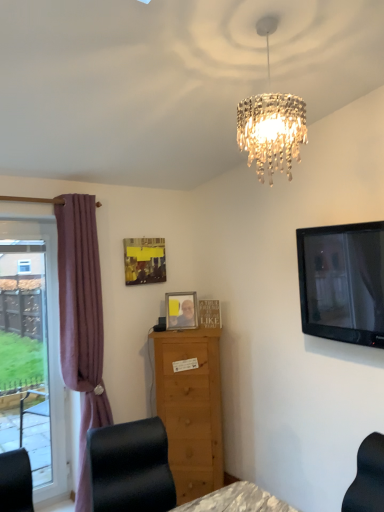
The height and width of the screenshot is (512, 384). What do you see at coordinates (210, 313) in the screenshot?
I see `wooden picture frame at center, which is the 3th picture frame in left-to-right order` at bounding box center [210, 313].

Measure the distance between matte plastic picture frame at center, which is the 2th picture frame from right to left, and camera.

A distance of 10.30 feet exists between matte plastic picture frame at center, which is the 2th picture frame from right to left, and camera.

Locate an element on the screen. This screenshot has width=384, height=512. light brown wooden chest of drawers at center is located at coordinates (191, 409).

Image resolution: width=384 pixels, height=512 pixels. Describe the element at coordinates (343, 282) in the screenshot. I see `black glossy tv at upper right` at that location.

Where is `matte yellow picture frame at upper center, which is the 3th picture frame from right to left`? matte yellow picture frame at upper center, which is the 3th picture frame from right to left is located at coordinates (144, 260).

Describe the element at coordinates (81, 321) in the screenshot. I see `mauve fabric curtain at left` at that location.

The height and width of the screenshot is (512, 384). I want to click on black leather chair at lower left, so click(131, 467).

At what (x,y) coordinates should I click in order to perform the action: click on wooden picture frame at center, positioned as the 1th picture frame in right-to-left order. Please return your answer as a coordinate pair (x, y). Image resolution: width=384 pixels, height=512 pixels. Looking at the image, I should click on (210, 313).

Between mauve fabric curtain at left and black leather chair at lower left, which one is positioned in front?

black leather chair at lower left.

In order to click on curtain lying above the black leather chair at lower left (from the image's perspective) in this screenshot , I will do [81, 321].

Considering the sizes of objects mauve fabric curtain at left and black leather chair at lower left in the image provided, who is taller, mauve fabric curtain at left or black leather chair at lower left?

Standing taller between the two is mauve fabric curtain at left.

Is point (82, 470) positioned in front of point (115, 498)?

No, (82, 470) is further to viewer.

From a real-world perspective, does clear glass window at left stand above wooden picture frame at center, positioned as the 1th picture frame in right-to-left order?

No, from a real-world perspective, clear glass window at left is not over wooden picture frame at center, positioned as the 1th picture frame in right-to-left order

In the image, is clear glass window at left positioned in front of or behind wooden picture frame at center, which is the 3th picture frame in left-to-right order?

Clearly, clear glass window at left is in front of wooden picture frame at center, which is the 3th picture frame in left-to-right order.

Between clear glass window at left and wooden picture frame at center, which is the 3th picture frame in left-to-right order, which one appears on the right side from the viewer's perspective?

wooden picture frame at center, which is the 3th picture frame in left-to-right order.

Is wooden picture frame at center, which is the 3th picture frame in left-to-right order, turned away from clear glass window at left?

That's not correct — wooden picture frame at center, which is the 3th picture frame in left-to-right order, is not looking away from clear glass window at left.

You are a GUI agent. You are given a task and a screenshot of the screen. Output one action in this format:
    pyautogui.click(x=<x>, y=<y>)
    Task: Click on the 1st picture frame above the clear glass window at left (from a real-world perspective)
    
    Given the screenshot: What is the action you would take?
    pyautogui.click(x=210, y=313)

Which object is thinner, wooden picture frame at center, which is the 3th picture frame in left-to-right order, or clear glass window at left?

With smaller width is wooden picture frame at center, which is the 3th picture frame in left-to-right order.

From the image's perspective, is wooden picture frame at center, which is the 3th picture frame in left-to-right order, over clear glass window at left?

Yes, from the image's perspective, wooden picture frame at center, which is the 3th picture frame in left-to-right order, is on top of clear glass window at left.

Considering the relative sizes of matte plastic picture frame at center, which is the 2th picture frame from right to left, and matte yellow picture frame at upper center, which is the first picture frame in left-to-right order, in the image provided, is matte plastic picture frame at center, which is the 2th picture frame from right to left, bigger than matte yellow picture frame at upper center, which is the first picture frame in left-to-right order,?

Incorrect, matte plastic picture frame at center, which is the 2th picture frame from right to left, is not larger than matte yellow picture frame at upper center, which is the first picture frame in left-to-right order.

In terms of width, does matte plastic picture frame at center, which is the 2th picture frame from right to left, look wider or thinner when compared to matte yellow picture frame at upper center, which is the first picture frame in left-to-right order?

matte plastic picture frame at center, which is the 2th picture frame from right to left, is wider than matte yellow picture frame at upper center, which is the first picture frame in left-to-right order.

Between matte plastic picture frame at center, the 2th picture frame viewed from the left, and matte yellow picture frame at upper center, which is the 3th picture frame from right to left, which one appears on the right side from the viewer's perspective?

matte plastic picture frame at center, the 2th picture frame viewed from the left.

From the image's perspective, which one is positioned lower, matte plastic picture frame at center, which is the 2th picture frame from right to left, or matte yellow picture frame at upper center, which is the first picture frame in left-to-right order?

matte plastic picture frame at center, which is the 2th picture frame from right to left, appears lower in the image.

Which object is positioned more to the left, black glossy tv at upper right or clear glass window at left?

Positioned to the left is clear glass window at left.

Looking at this image, is black glossy tv at upper right in contact with clear glass window at left?

They are not placed beside each other.

Locate an element on the screen. window behind the black glossy tv at upper right is located at coordinates (34, 349).

Which object is more forward, mauve fabric curtain at left or black glossy tv at upper right?

black glossy tv at upper right is more forward.

Are mauve fabric curtain at left and black glossy tv at upper right far apart?

Yes, mauve fabric curtain at left and black glossy tv at upper right are quite far apart.

Can you tell me how much mauve fabric curtain at left and black glossy tv at upper right differ in facing direction?

The facing directions of mauve fabric curtain at left and black glossy tv at upper right are 91.9 degrees apart.

Is mauve fabric curtain at left to the right of black glossy tv at upper right from the viewer's perspective?

No, mauve fabric curtain at left is not to the right of black glossy tv at upper right.

Is light brown wooden chest of drawers at center oriented towards matte yellow picture frame at upper center, which is the first picture frame in left-to-right order?

No, light brown wooden chest of drawers at center is not facing towards matte yellow picture frame at upper center, which is the first picture frame in left-to-right order.

Does light brown wooden chest of drawers at center touch matte yellow picture frame at upper center, which is the first picture frame in left-to-right order?

No, light brown wooden chest of drawers at center is not with matte yellow picture frame at upper center, which is the first picture frame in left-to-right order.

Can you tell me how much light brown wooden chest of drawers at center and matte yellow picture frame at upper center, which is the 3th picture frame from right to left, differ in facing direction?

44.1 degrees separate the facing orientations of light brown wooden chest of drawers at center and matte yellow picture frame at upper center, which is the 3th picture frame from right to left.

Can you confirm if light brown wooden chest of drawers at center is bigger than matte yellow picture frame at upper center, which is the first picture frame in left-to-right order?

Indeed, light brown wooden chest of drawers at center has a larger size compared to matte yellow picture frame at upper center, which is the first picture frame in left-to-right order.

Find the location of a particular element. This screenshot has width=384, height=512. furniture that is below the mauve fabric curtain at left (from the image's perspective) is located at coordinates (131, 467).

From a real-world perspective, which picture frame is the 1st one above the clear glass window at left? Please provide its 2D coordinates.

[(210, 313)]

Looking at the image, which one is located closer to matte plastic picture frame at center, the 2th picture frame viewed from the left, black leather chair at lower left or matte yellow picture frame at upper center, which is the 3th picture frame from right to left?

matte yellow picture frame at upper center, which is the 3th picture frame from right to left.

Looking at the image, which one is located closer to black glossy tv at upper right, wooden picture frame at center, positioned as the 1th picture frame in right-to-left order, or black leather chair at lower left?

The object closer to black glossy tv at upper right is wooden picture frame at center, positioned as the 1th picture frame in right-to-left order.

From the image, which object appears to be nearer to wooden picture frame at center, positioned as the 1th picture frame in right-to-left order, black leather chair at lower left or matte plastic picture frame at center, which is the 2th picture frame from right to left?

matte plastic picture frame at center, which is the 2th picture frame from right to left, is closer to wooden picture frame at center, positioned as the 1th picture frame in right-to-left order.

Estimate the real-world distances between objects in this image. Which object is closer to black leather chair at lower left, wooden picture frame at center, positioned as the 1th picture frame in right-to-left order, or clear glass window at left?

wooden picture frame at center, positioned as the 1th picture frame in right-to-left order, is positioned closer to the anchor black leather chair at lower left.

Estimate the real-world distances between objects in this image. Which object is further from black glossy tv at upper right, matte yellow picture frame at upper center, which is the first picture frame in left-to-right order, or light brown wooden chest of drawers at center?

The object further to black glossy tv at upper right is matte yellow picture frame at upper center, which is the first picture frame in left-to-right order.

Based on their spatial positions, is black leather chair at lower left or clear glass window at left further from black glossy tv at upper right?

Based on the image, clear glass window at left appears to be further to black glossy tv at upper right.

From the image, which object appears to be farther from black leather chair at lower left, clear glass window at left or black glossy tv at upper right?

black glossy tv at upper right is further to black leather chair at lower left.

From the image, which object appears to be farther from wooden picture frame at center, positioned as the 1th picture frame in right-to-left order, matte yellow picture frame at upper center, which is the first picture frame in left-to-right order, or black glossy tv at upper right?

black glossy tv at upper right is further to wooden picture frame at center, positioned as the 1th picture frame in right-to-left order.

Find the location of a particular element. This screenshot has height=512, width=384. curtain situated between clear glass window at left and wooden picture frame at center, which is the 3th picture frame in left-to-right order, from left to right is located at coordinates (81, 321).

Locate an element on the screen. This screenshot has height=512, width=384. curtain that lies between matte plastic picture frame at center, which is the 2th picture frame from right to left, and light brown wooden chest of drawers at center from top to bottom is located at coordinates (81, 321).

The image size is (384, 512). Find the location of `curtain between clear glass window at left and matte plastic picture frame at center, the 2th picture frame viewed from the left`. curtain between clear glass window at left and matte plastic picture frame at center, the 2th picture frame viewed from the left is located at coordinates (81, 321).

The width and height of the screenshot is (384, 512). Identify the location of window between matte yellow picture frame at upper center, which is the 3th picture frame from right to left, and light brown wooden chest of drawers at center vertically. (34, 349).